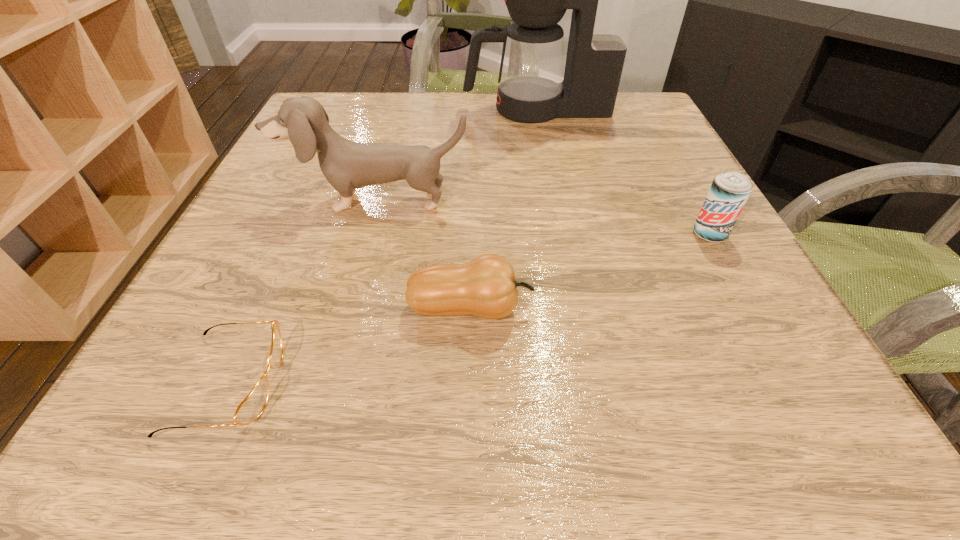
At what (x,y) coordinates should I click in order to perform the action: click on free space between the rightmost object and the coffee maker. Please return your answer as a coordinate pair (x, y). Image resolution: width=960 pixels, height=540 pixels. Looking at the image, I should click on (623, 172).

The width and height of the screenshot is (960, 540). I want to click on vacant space in between the gourd and the spectacles, so click(349, 346).

In order to click on vacant space in between the coffee maker and the nearest object in this screenshot , I will do `click(383, 246)`.

Locate an element on the screen. The width and height of the screenshot is (960, 540). vacant region between the coffee maker and the second farthest object is located at coordinates (456, 155).

Find the location of a particular element. empty space between the coffee maker and the gourd is located at coordinates (504, 208).

Locate an element on the screen. vacant region between the fourth farthest object and the farthest object is located at coordinates (504, 208).

Image resolution: width=960 pixels, height=540 pixels. Identify the location of free space between the puppy and the spectacles. (302, 292).

Locate an element on the screen. unoccupied area between the second tallest object and the third tallest object is located at coordinates (542, 218).

At what (x,y) coordinates should I click in order to perform the action: click on the fourth closest object to the nearest object. Please return your answer as a coordinate pair (x, y). Looking at the image, I should click on (729, 192).

Locate which object ranks third in proximity to the tallest object. Please provide its 2D coordinates. Your answer should be formatted as a tuple, i.e. [(x, y)], where the tuple contains the x and y coordinates of a point satisfying the conditions above.

[(486, 287)]